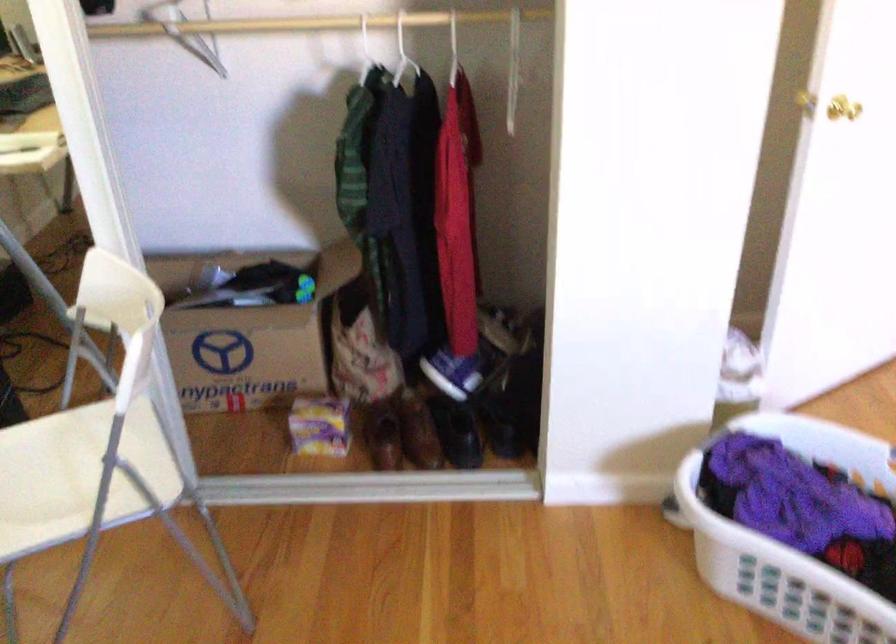
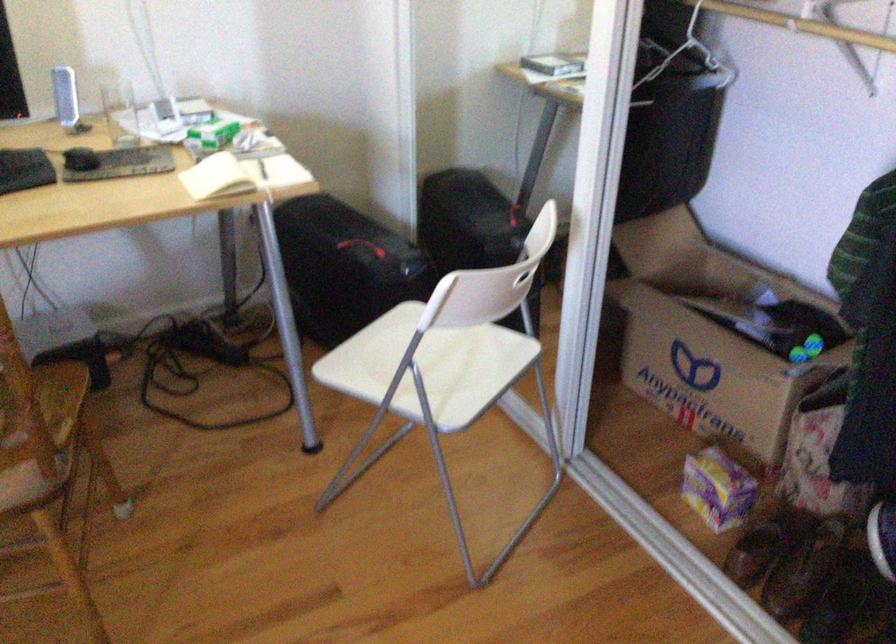
Question: I am providing you with two images of the same scene from different viewpoints. After the viewpoint changes to image2, which objects are now occluded?

Choices:
 (A) black hanging bin
 (B) cardboard shipping box
 (C) white wire hanger
 (D) none of these

Answer: (D)